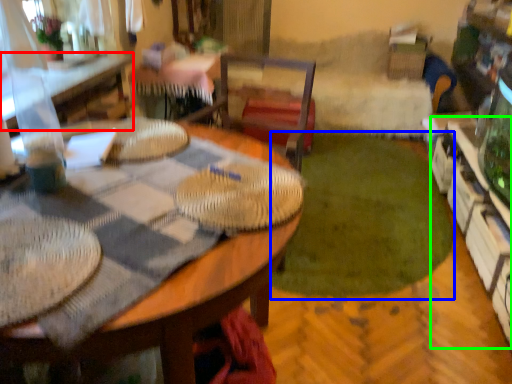
Question: Which object is the closest to the table (highlighted by a red box)? Choose among these: grass (highlighted by a blue box) or shelf (highlighted by a green box).

Choices:
 (A) grass
 (B) shelf

Answer: (A)